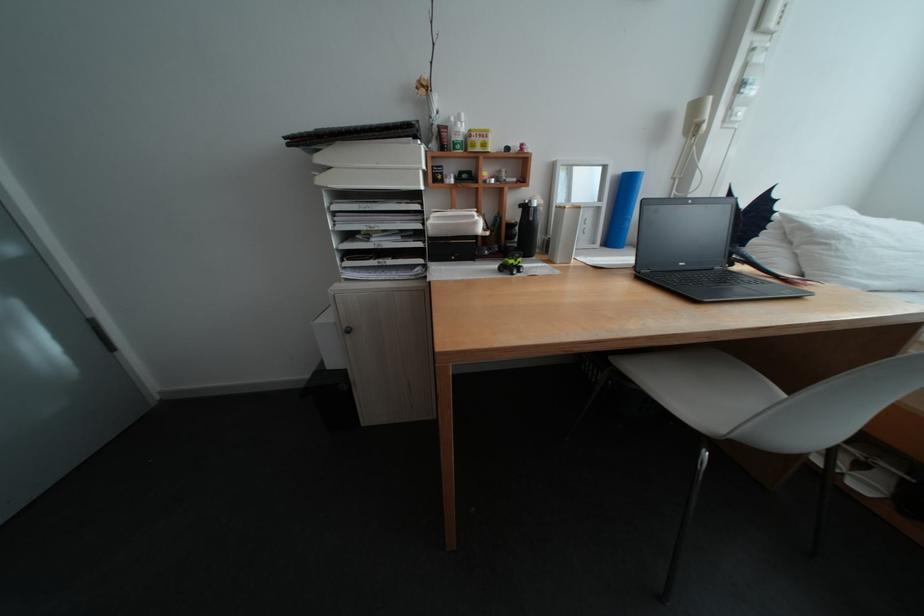
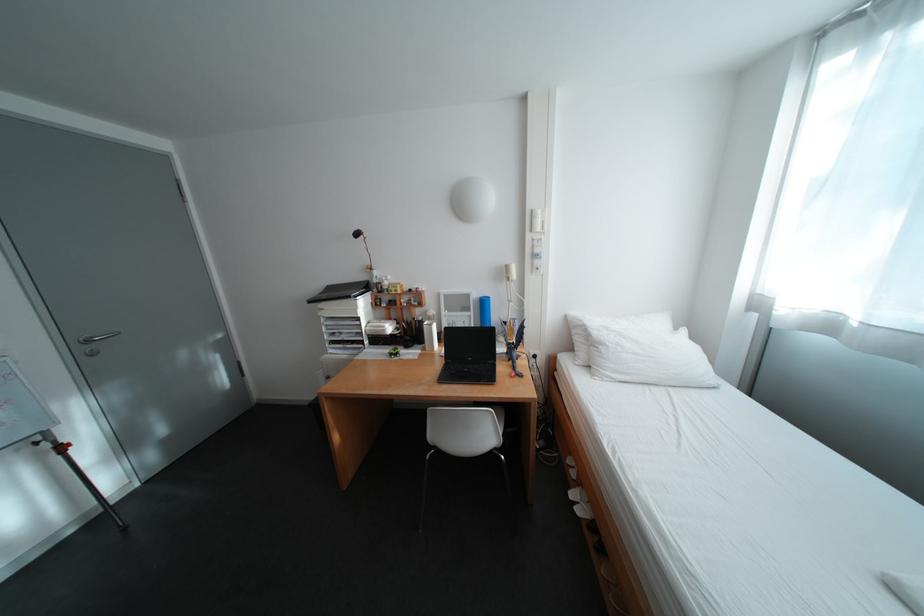
Find the pixel in the second image that matches (x=543, y=220) in the first image.

(430, 326)